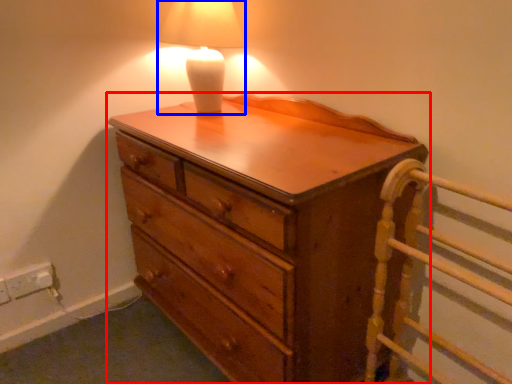
Question: Among these objects, which one is nearest to the camera, chest of drawers (highlighted by a red box) or lamp (highlighted by a blue box)?

Choices:
 (A) chest of drawers
 (B) lamp

Answer: (A)